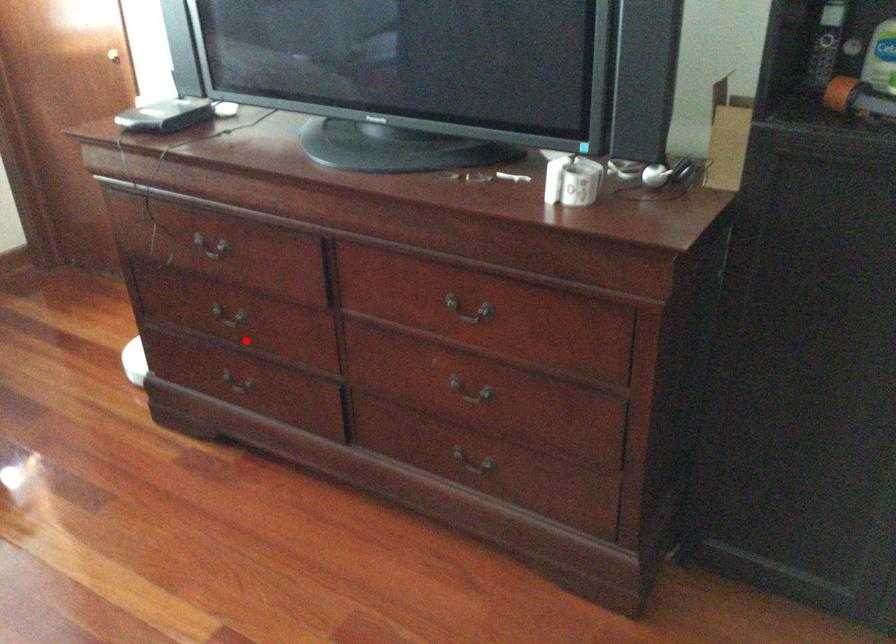
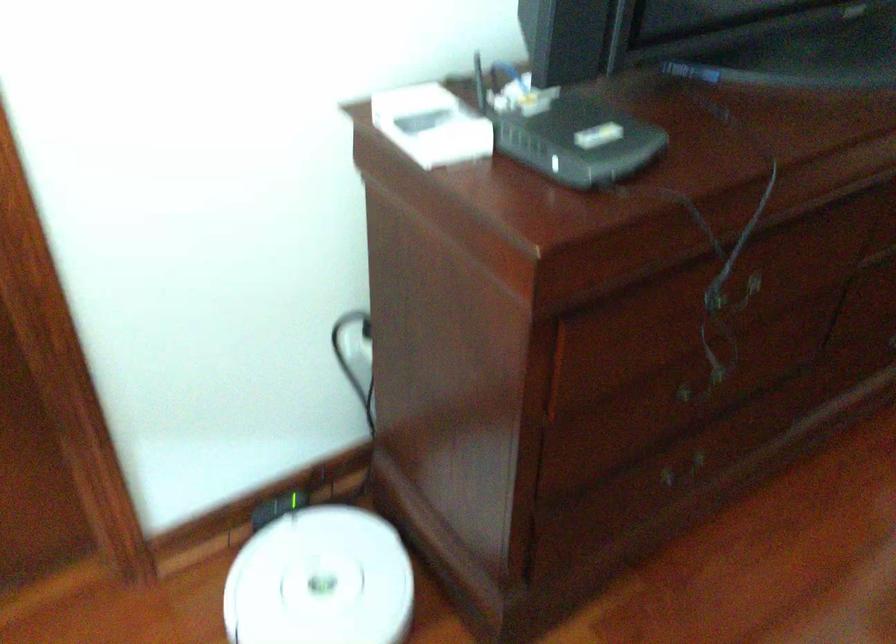
Find the pixel in the second image that matches the highlighted location in the first image.

(702, 384)